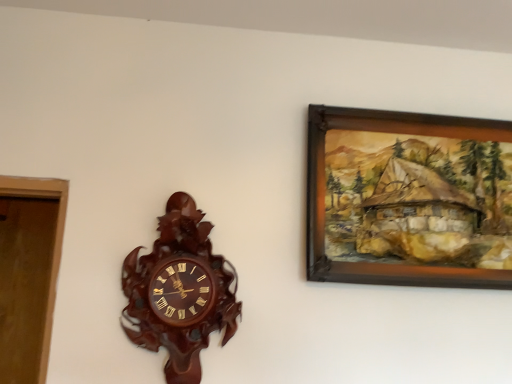
Question: Could you tell me if wooden carved clock at center-left is turned towards wooden picture frame at upper right?

Choices:
 (A) no
 (B) yes

Answer: (A)

Question: Is wooden carved clock at center-left outside of wooden picture frame at upper right?

Choices:
 (A) yes
 (B) no

Answer: (A)

Question: From the image's perspective, would you say wooden carved clock at center-left is shown under wooden picture frame at upper right?

Choices:
 (A) no
 (B) yes

Answer: (B)

Question: Is wooden carved clock at center-left thinner than wooden picture frame at upper right?

Choices:
 (A) no
 (B) yes

Answer: (A)

Question: Considering the relative positions of wooden carved clock at center-left and wooden picture frame at upper right in the image provided, is wooden carved clock at center-left to the left of wooden picture frame at upper right from the viewer's perspective?

Choices:
 (A) yes
 (B) no

Answer: (A)

Question: From a real-world perspective, is wooden carved clock at center-left located higher than wooden picture frame at upper right?

Choices:
 (A) no
 (B) yes

Answer: (A)

Question: Is wooden picture frame at upper right bigger than wooden carved clock at center-left?

Choices:
 (A) no
 (B) yes

Answer: (B)

Question: Is wooden picture frame at upper right facing away from wooden carved clock at center-left?

Choices:
 (A) yes
 (B) no

Answer: (B)

Question: From the image's perspective, is wooden picture frame at upper right located beneath wooden carved clock at center-left?

Choices:
 (A) no
 (B) yes

Answer: (A)

Question: Is wooden picture frame at upper right facing towards wooden carved clock at center-left?

Choices:
 (A) no
 (B) yes

Answer: (A)

Question: From a real-world perspective, is wooden picture frame at upper right located beneath wooden carved clock at center-left?

Choices:
 (A) no
 (B) yes

Answer: (A)

Question: Is wooden picture frame at upper right positioned before wooden carved clock at center-left?

Choices:
 (A) no
 (B) yes

Answer: (A)

Question: From the image's perspective, is wooden carved clock at center-left located above or below wooden picture frame at upper right?

Choices:
 (A) above
 (B) below

Answer: (B)